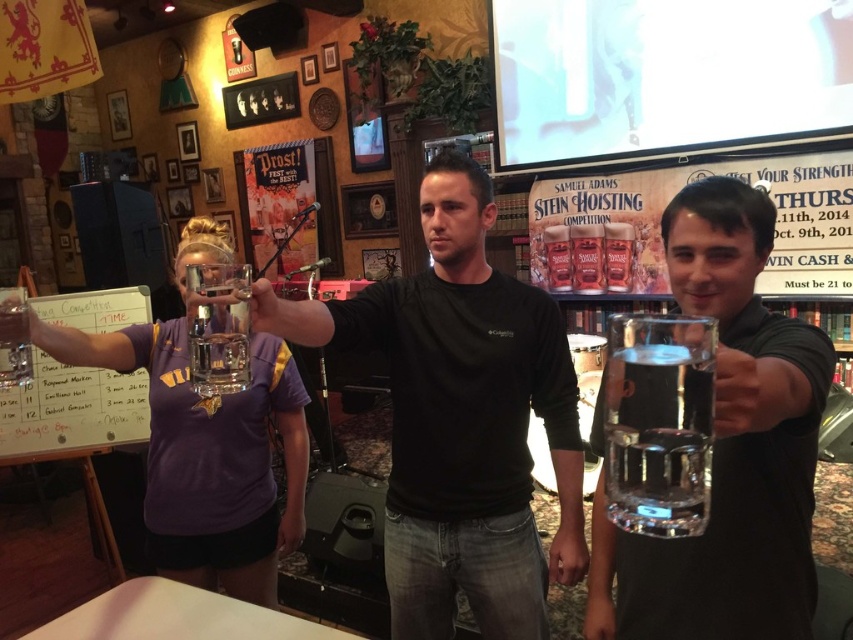
Question: Is black matte shirt at center below clear glass mug at center?

Choices:
 (A) yes
 (B) no

Answer: (A)

Question: Among these points, which one is farthest from the camera?

Choices:
 (A) (759, 220)
 (B) (83, 416)

Answer: (B)

Question: Which of the following is the closest to the observer?

Choices:
 (A) black matte shirt at center
 (B) clear glass beer at center
 (C) clear glass at center
 (D) clear glass mug at center

Answer: (B)

Question: Is clear glass beer at center above white dry erase board at left?

Choices:
 (A) no
 (B) yes

Answer: (B)

Question: From the image, what is the correct spatial relationship of clear glass mug at center in relation to clear glass at center?

Choices:
 (A) above
 (B) below

Answer: (B)

Question: Which point is farther to the camera?

Choices:
 (A) (238, 378)
 (B) (595, 625)
 (C) (36, 387)
 (D) (469, 244)

Answer: (C)